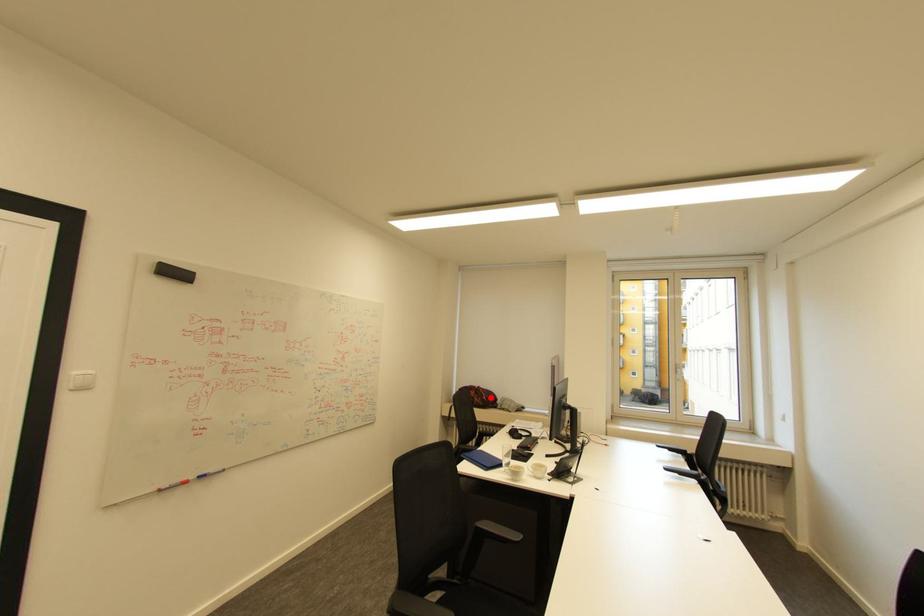
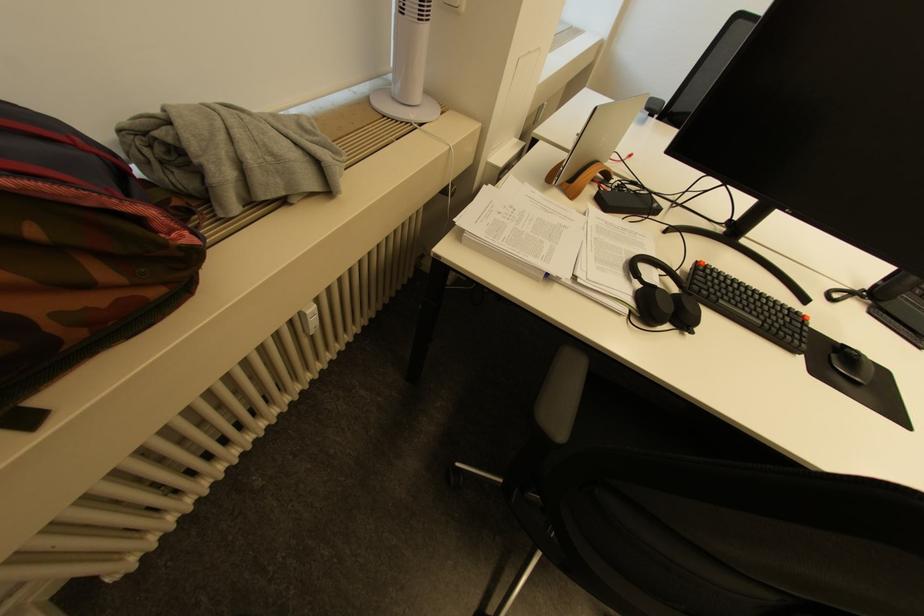
Where in the second image is the point corresponding to the highlighted location from the first image?

(196, 238)